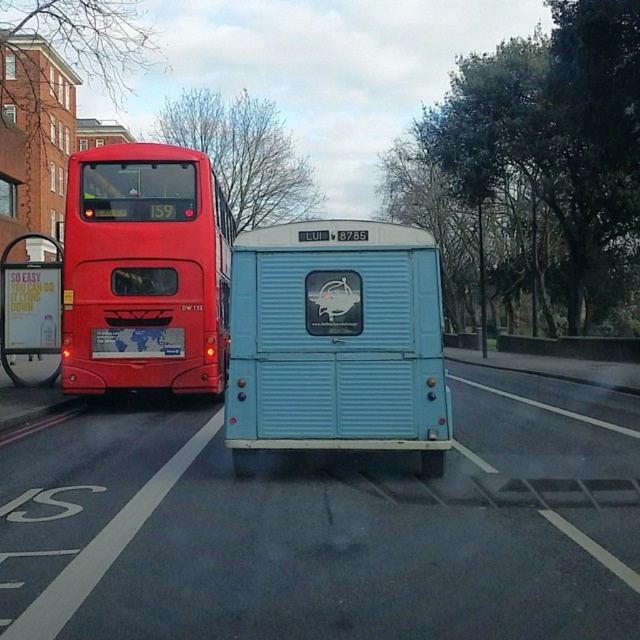
This screenshot has width=640, height=640. What do you see at coordinates (145, 272) in the screenshot?
I see `matte red bus at left` at bounding box center [145, 272].

Does matte red bus at left have a greater height compared to white plastic license plate at rear center?

Yes.

At what (x,y) coordinates should I click in order to perform the action: click on matte red bus at left. Please return your answer as a coordinate pair (x, y). Image resolution: width=640 pixels, height=640 pixels. Looking at the image, I should click on (145, 272).

Identify the location of matte red bus at left. (145, 272).

Which is in front, point (52, 296) or point (161, 353)?

Point (161, 353) is in front.

Is point (12, 353) less distant than point (147, 328)?

No.

Which is in front, point (8, 289) or point (136, 348)?

Point (136, 348)

Where is `white plastic sign at left`? white plastic sign at left is located at coordinates 29,308.

Between point (444, 442) and point (125, 333), which one is positioned in front?

Point (444, 442)

I want to click on light blue corrugated metal bus at center, so click(337, 340).